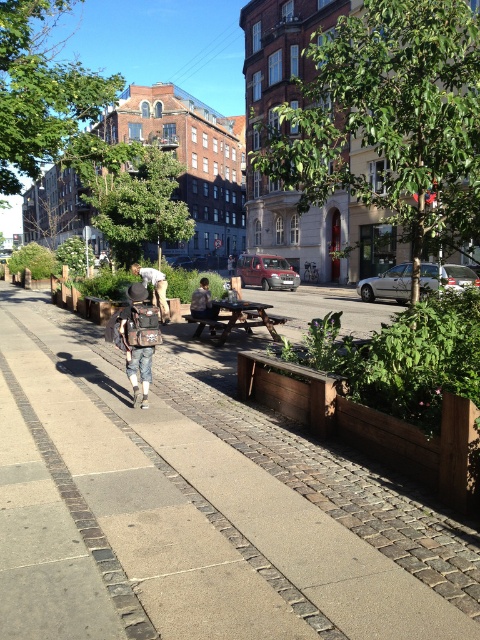
You are standing at the picnic table in the middle ground and want to take a photo of both points, point [136,292] and point [217,307]. Which point will appear larger in your camera view?

Point [136,292] is closer to the camera than point [217,307], so it will appear larger in the camera view.

You are standing at the point labeled as point (206, 512) in the image. What type of surface are you currently standing on?

The point labeled as point (206, 512) is on brown wooden pavement at center, so you are standing on brown wooden pavement.